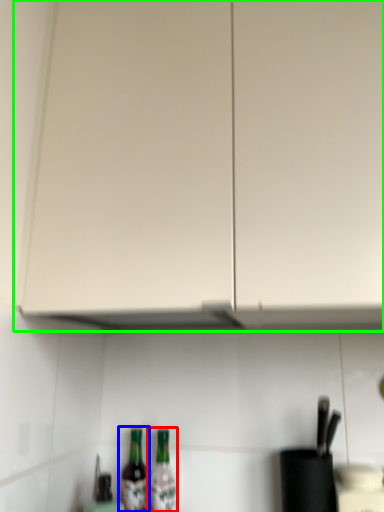
Question: Which object is the farthest from bottle (highlighted by a red box)? Choose among these: bottle (highlighted by a blue box) or cabinetry (highlighted by a green box).

Choices:
 (A) bottle
 (B) cabinetry

Answer: (B)